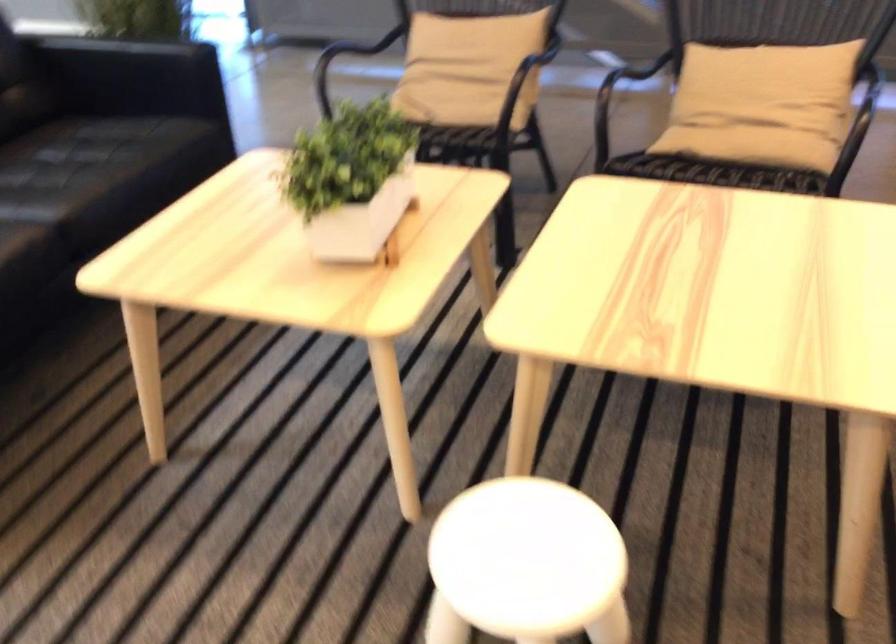
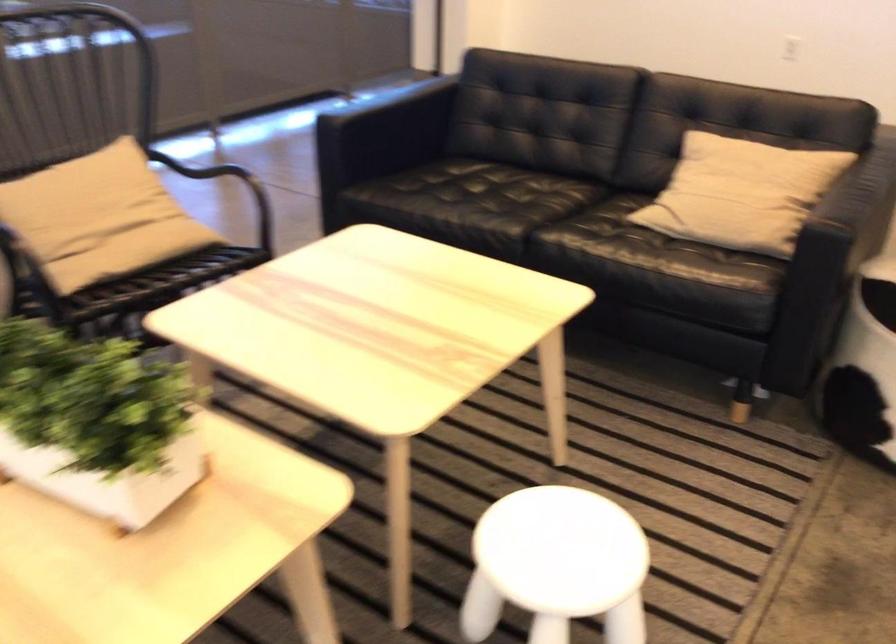
Where in the second image is the point corresponding to point 756,146 from the first image?

(151, 254)